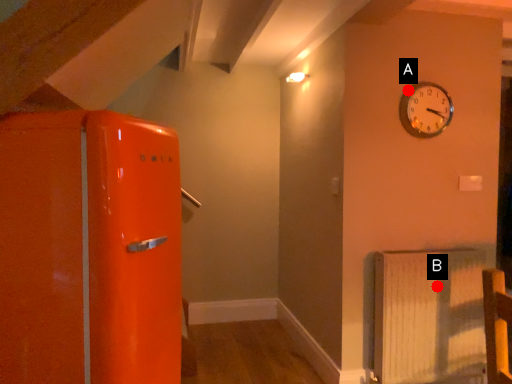
Question: Two points are circled on the image, labeled by A and B beside each circle. Which point is closer to the camera?

Choices:
 (A) A is closer
 (B) B is closer

Answer: (B)